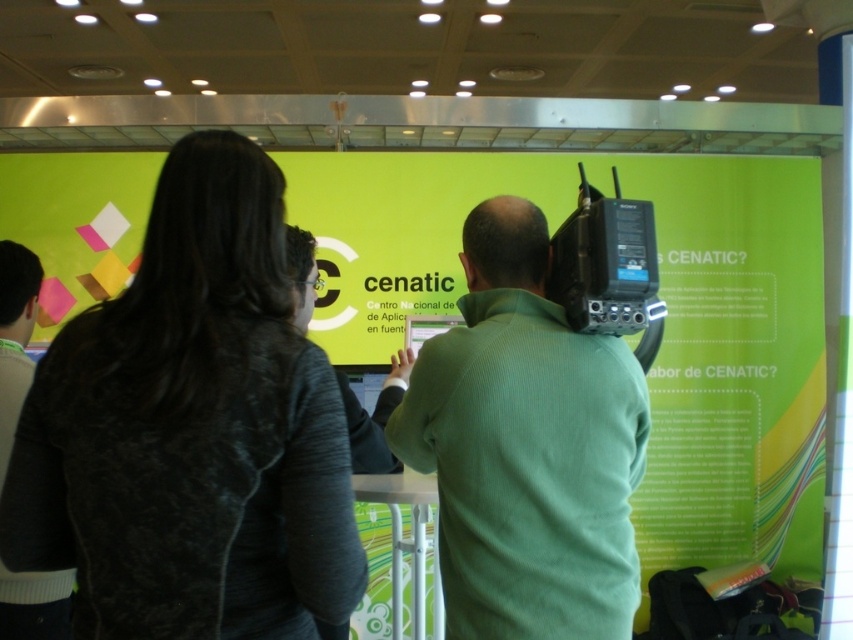
Can you confirm if green matte poster at center is shorter than green matte shirt at center?

In fact, green matte poster at center may be taller than green matte shirt at center.

Who is more forward, [364,253] or [305,324]?

Point [305,324] is in front.

You are a GUI agent. You are given a task and a screenshot of the screen. Output one action in this format:
    pyautogui.click(x=<x>, y=<y>)
    Task: Click on the green matte poster at center
    Image resolution: width=853 pixels, height=640 pixels.
    Given the screenshot: What is the action you would take?
    pyautogui.click(x=664, y=321)

Consider the image. Does dark gray sweater at center have a greater height compared to green matte shirt at center?

Correct, dark gray sweater at center is much taller as green matte shirt at center.

Is point (215, 193) more distant than point (354, 436)?

That is False.

Does point (184, 624) come in front of point (357, 445)?

That is True.

Identify the location of dark gray sweater at center. (192, 432).

Is dark gray sweater at left taller than green matte shirt at center?

Yes, dark gray sweater at left is taller than green matte shirt at center.

From the picture: Is dark gray sweater at left to the left of green matte shirt at center from the viewer's perspective?

→ Indeed, dark gray sweater at left is positioned on the left side of green matte shirt at center.

Is point (0, 484) positioned behind point (355, 465)?

Yes, it is.

Locate an element on the screen. dark gray sweater at left is located at coordinates (15, 337).